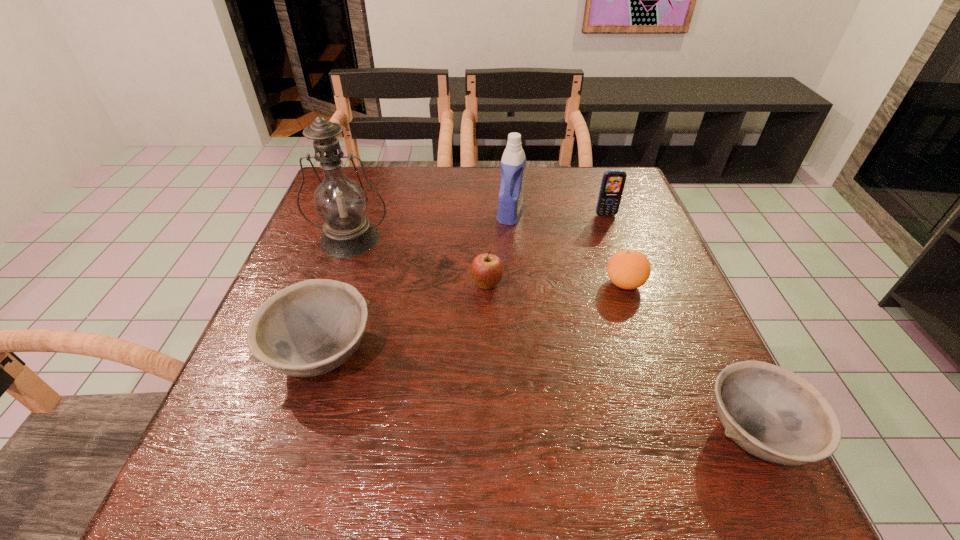
Please point a spot to place another bowl for symmetrical spacing. Please provide its 2D coordinates. Your answer should be formatted as a tuple, i.e. [(x, y)], where the tuple contains the x and y coordinates of a point satisfying the conditions above.

[(521, 391)]